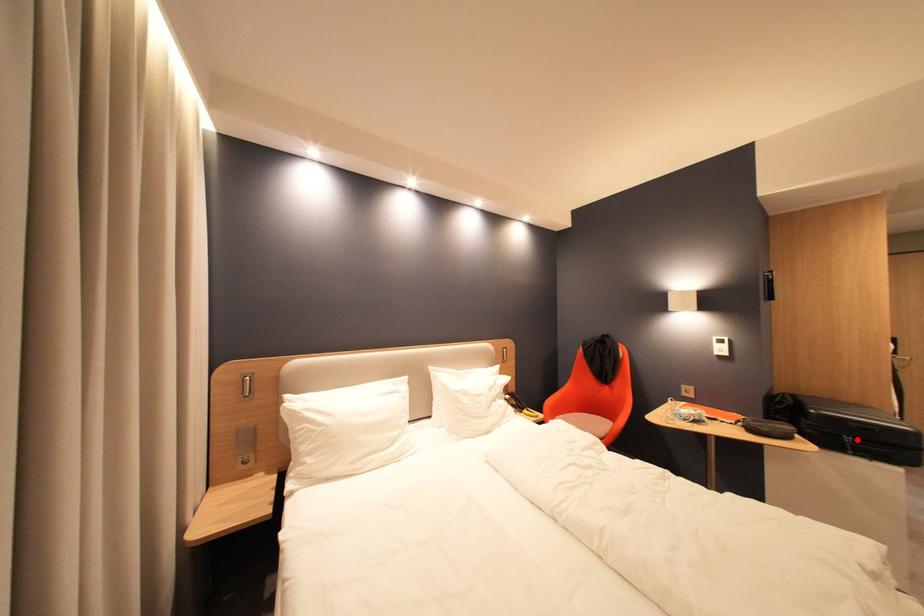
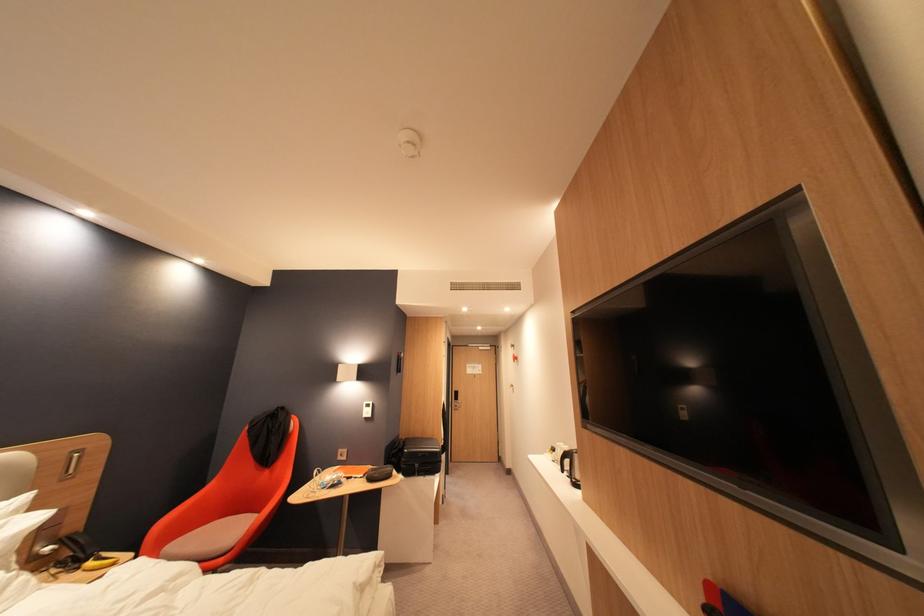
Question: I am providing you with two images of the same scene from different viewpoints. Image1 has a red point marked. In image2, the corresponding 3D location appears at what relative position? Reply with the corresponding letter.

Choices:
 (A) Closer
 (B) Farther

Answer: (B)